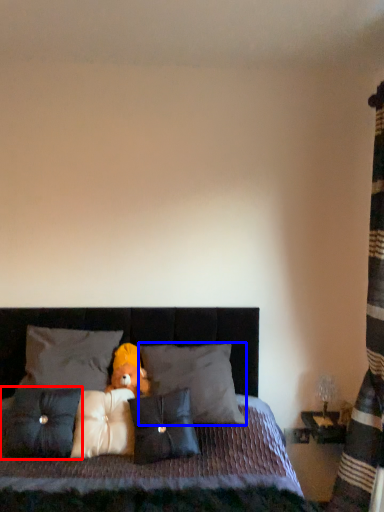
Question: Among these objects, which one is farthest to the camera, pillow (highlighted by a red box) or pillow (highlighted by a blue box)?

Choices:
 (A) pillow
 (B) pillow

Answer: (B)